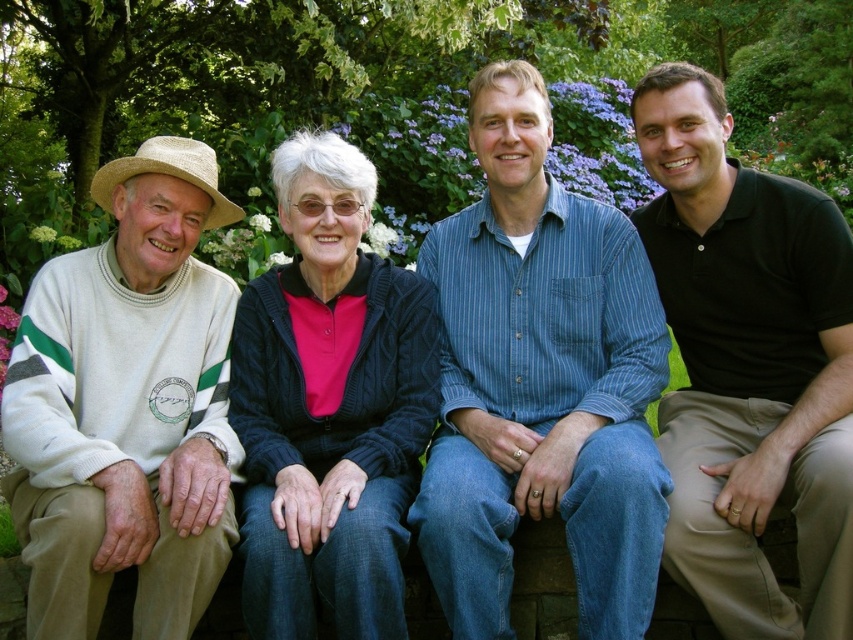
Is white knit sweater at left further to the viewer compared to black cotton polo shirt at right?

No, white knit sweater at left is in front of black cotton polo shirt at right.

Which of these two, white knit sweater at left or black cotton polo shirt at right, stands taller?

black cotton polo shirt at right is taller.

Is point (192, 483) more distant than point (643, 134)?

No, it is not.

The image size is (853, 640). In order to click on white knit sweater at left in this screenshot , I will do `click(126, 406)`.

Measure the distance between point [221,380] and camera.

12.52 feet

Does white knit sweater at left have a smaller size compared to cable-knit sweater at center?

No.

The height and width of the screenshot is (640, 853). Identify the location of white knit sweater at left. (x=126, y=406).

Is blue striped shirt at center smaller than white knit sweater at left?

No, blue striped shirt at center is not smaller than white knit sweater at left.

Between point (509, 518) and point (45, 445), which one is positioned in front?

Point (45, 445)

Identify the location of blue striped shirt at center. (540, 381).

The height and width of the screenshot is (640, 853). Find the location of `blue striped shirt at center`. blue striped shirt at center is located at coordinates (540, 381).